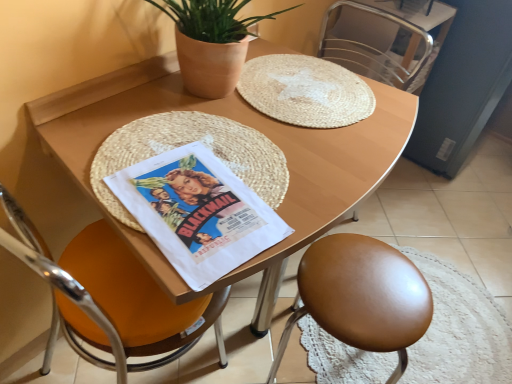
The height and width of the screenshot is (384, 512). I want to click on vacant area that is situated to the right of white paper comic book at center, so 317,195.